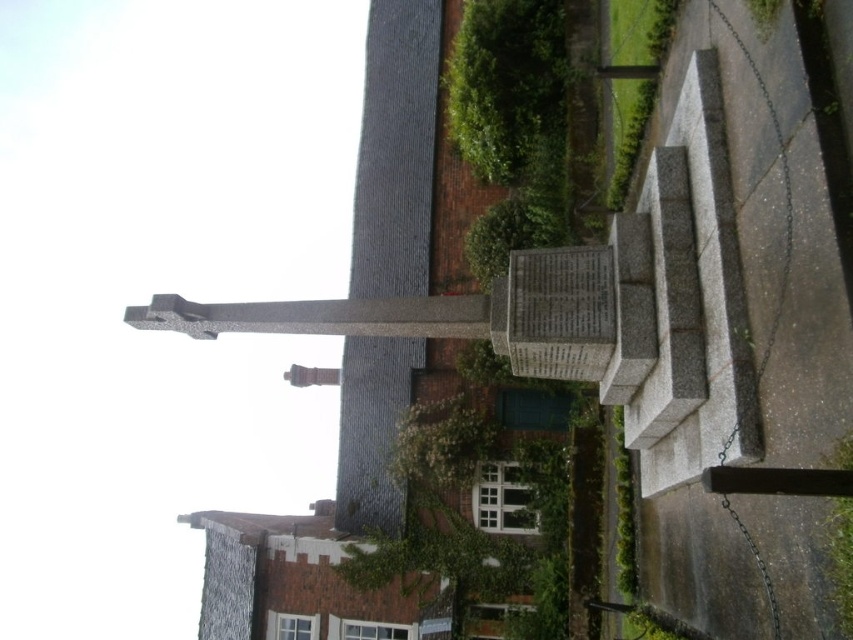
Is green mossy stone at upper center taller than green leafy plant at lower right?

Correct, green mossy stone at upper center is much taller as green leafy plant at lower right.

Is green mossy stone at upper center to the left of green leafy plant at lower right from the viewer's perspective?

Correct, you'll find green mossy stone at upper center to the left of green leafy plant at lower right.

Is point (482, 84) in front of point (848, 576)?

No, it is not.

At what (x,y) coordinates should I click in order to perform the action: click on green mossy stone at upper center. Please return your answer as a coordinate pair (x, y). This screenshot has height=640, width=853. Looking at the image, I should click on (505, 83).